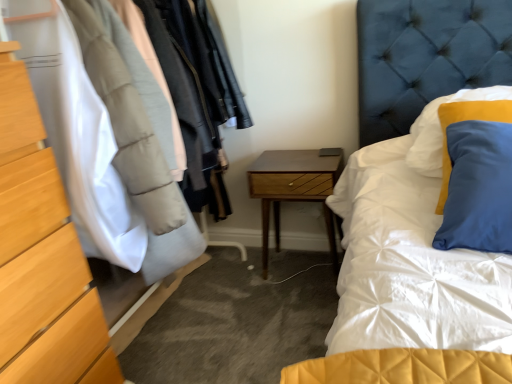
At what (x,y) coordinates should I click in order to perform the action: click on woodenmaterial/texturenightstand at center. Please return your answer as a coordinate pair (x, y). Looking at the image, I should click on (294, 189).

Does woodenmaterial/texturenightstand at center touch matte wood chest of drawers at left?

No.

Considering the points (264, 231) and (1, 194), which point is behind, point (264, 231) or point (1, 194)?

The point (264, 231) is behind.

Which of these two, woodenmaterial/texturenightstand at center or matte wood chest of drawers at left, stands taller?

matte wood chest of drawers at left is taller.

From the image's perspective, does woodenmaterial/texturenightstand at center appear higher than matte wood chest of drawers at left?

Yes, from the image's perspective, woodenmaterial/texturenightstand at center is above matte wood chest of drawers at left.

Is wooden dresser at left at the back of woodenmaterial/texturenightstand at center?

woodenmaterial/texturenightstand at center does not have its back to wooden dresser at left.

From a real-world perspective, between woodenmaterial/texturenightstand at center and wooden dresser at left, who is vertically lower?

In real-world perspective, woodenmaterial/texturenightstand at center is lower.

Is woodenmaterial/texturenightstand at center beside wooden dresser at left?

woodenmaterial/texturenightstand at center is not next to wooden dresser at left, and they're not touching.

Looking at their sizes, would you say woodenmaterial/texturenightstand at center is wider or thinner than wooden dresser at left?

Considering their sizes, woodenmaterial/texturenightstand at center looks slimmer than wooden dresser at left.

Is matte wood chest of drawers at left at the right side of wooden dresser at left?

No, matte wood chest of drawers at left is not to the right of wooden dresser at left.

Is wooden dresser at left surrounded by matte wood chest of drawers at left?

No, wooden dresser at left is not inside matte wood chest of drawers at left.

From a real-world perspective, is matte wood chest of drawers at left physically above wooden dresser at left?

Incorrect, from a real-world perspective, matte wood chest of drawers at left is lower than wooden dresser at left.

From the image's perspective, is matte wood chest of drawers at left located beneath wooden dresser at left?

Yes.

Are matte wood chest of drawers at left and woodenmaterial/texturenightstand at center beside each other?

No, matte wood chest of drawers at left is not in contact with woodenmaterial/texturenightstand at center.

Is matte wood chest of drawers at left in front of woodenmaterial/texturenightstand at center?

Yes, matte wood chest of drawers at left is in front of woodenmaterial/texturenightstand at center.

Would you say matte wood chest of drawers at left contains woodenmaterial/texturenightstand at center?

No, matte wood chest of drawers at left does not contain woodenmaterial/texturenightstand at center.

From a real-world perspective, between matte wood chest of drawers at left and woodenmaterial/texturenightstand at center, who is vertically lower?

In real-world perspective, woodenmaterial/texturenightstand at center is lower.

Between wooden dresser at left and matte wood chest of drawers at left, which one has smaller size?

Smaller between the two is matte wood chest of drawers at left.

Is the position of wooden dresser at left less distant than that of matte wood chest of drawers at left?

That is False.

From the image's perspective, which is below, wooden dresser at left or matte wood chest of drawers at left?

matte wood chest of drawers at left is shown below in the image.

Consider the image. Does wooden dresser at left contain matte wood chest of drawers at left?

No, matte wood chest of drawers at left is not surrounded by wooden dresser at left.

Is wooden dresser at left not close to woodenmaterial/texturenightstand at center?

No, wooden dresser at left is in close proximity to woodenmaterial/texturenightstand at center.

Is wooden dresser at left aimed at woodenmaterial/texturenightstand at center?

Yes, wooden dresser at left faces towards woodenmaterial/texturenightstand at center.

Consider the image. Considering the sizes of wooden dresser at left and woodenmaterial/texturenightstand at center in the image, is wooden dresser at left wider or thinner than woodenmaterial/texturenightstand at center?

In the image, wooden dresser at left appears to be wider than woodenmaterial/texturenightstand at center.

How much distance is there between wooden dresser at left and woodenmaterial/texturenightstand at center?

wooden dresser at left is 85.60 centimeters away from woodenmaterial/texturenightstand at center.

Identify the location of the chest of drawers in front of the woodenmaterial/texturenightstand at center. This screenshot has height=384, width=512. (41, 256).

This screenshot has width=512, height=384. Find the location of `dresser that is on the left side of woodenmaterial/texturenightstand at center`. dresser that is on the left side of woodenmaterial/texturenightstand at center is located at coordinates (59, 204).

From the image, which object appears to be farther from woodenmaterial/texturenightstand at center, matte wood chest of drawers at left or wooden dresser at left?

The object further to woodenmaterial/texturenightstand at center is matte wood chest of drawers at left.

When comparing their distances from woodenmaterial/texturenightstand at center, does wooden dresser at left or matte wood chest of drawers at left seem further?

matte wood chest of drawers at left.

Looking at the image, which one is located further to wooden dresser at left, matte wood chest of drawers at left or woodenmaterial/texturenightstand at center?

woodenmaterial/texturenightstand at center lies further to wooden dresser at left than the other object.

From the image, which object appears to be farther from matte wood chest of drawers at left, wooden dresser at left or woodenmaterial/texturenightstand at center?

woodenmaterial/texturenightstand at center lies further to matte wood chest of drawers at left than the other object.

Looking at this image, estimate the real-world distances between objects in this image. Which object is closer to matte wood chest of drawers at left, woodenmaterial/texturenightstand at center or wooden dresser at left?

wooden dresser at left is closer to matte wood chest of drawers at left.

Looking at the image, which one is located further to wooden dresser at left, woodenmaterial/texturenightstand at center or matte wood chest of drawers at left?

Among the two, woodenmaterial/texturenightstand at center is located further to wooden dresser at left.

Where is `dresser between matte wood chest of drawers at left and woodenmaterial/texturenightstand at center from front to back`? dresser between matte wood chest of drawers at left and woodenmaterial/texturenightstand at center from front to back is located at coordinates 59,204.